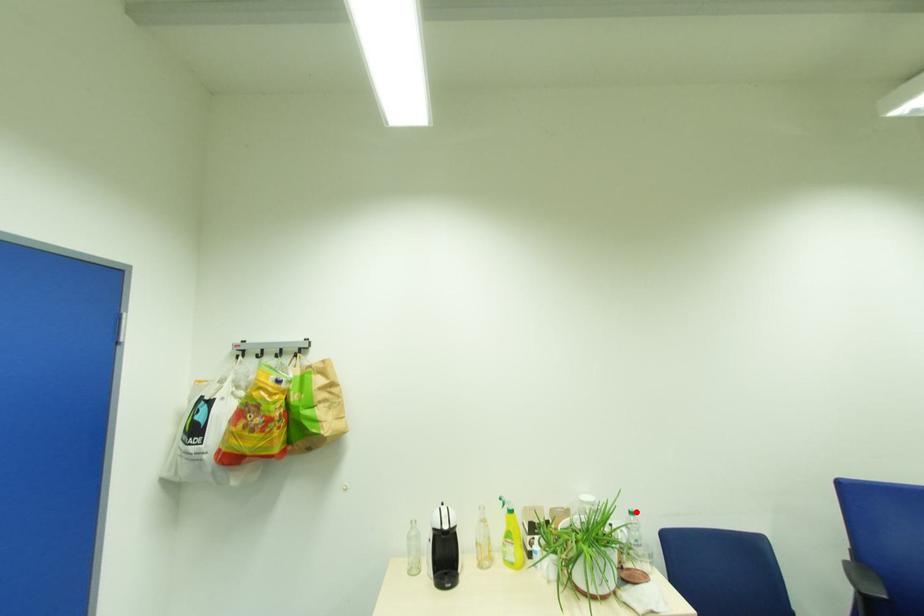
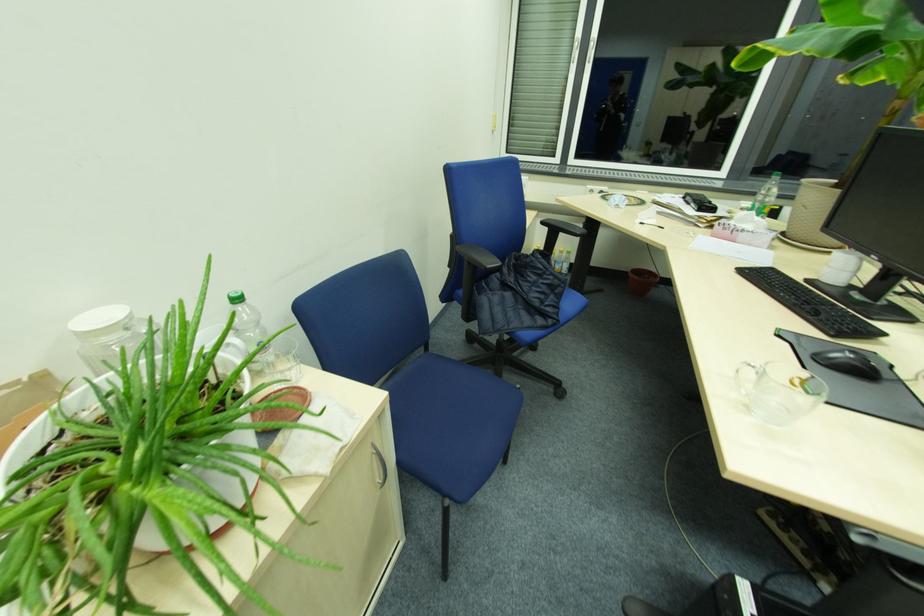
Question: A red point is marked in image1. In image2, is the corresponding 3D point closer to the camera or farther? Reply with the corresponding letter.

Choices:
 (A) The corresponding 3D point is closer.
 (B) The corresponding 3D point is farther.

Answer: (A)